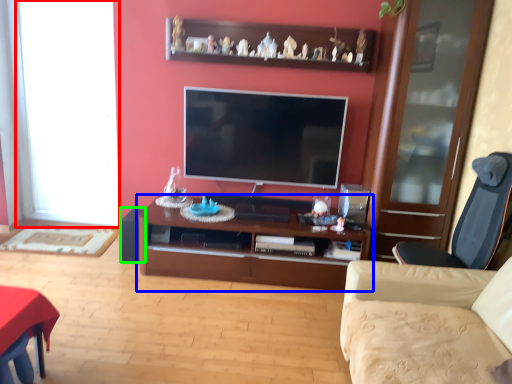
Question: Considering the real-world distances, which object is closest to window (highlighted by a red box)? cabinetry (highlighted by a blue box) or speaker (highlighted by a green box).

Choices:
 (A) cabinetry
 (B) speaker

Answer: (B)